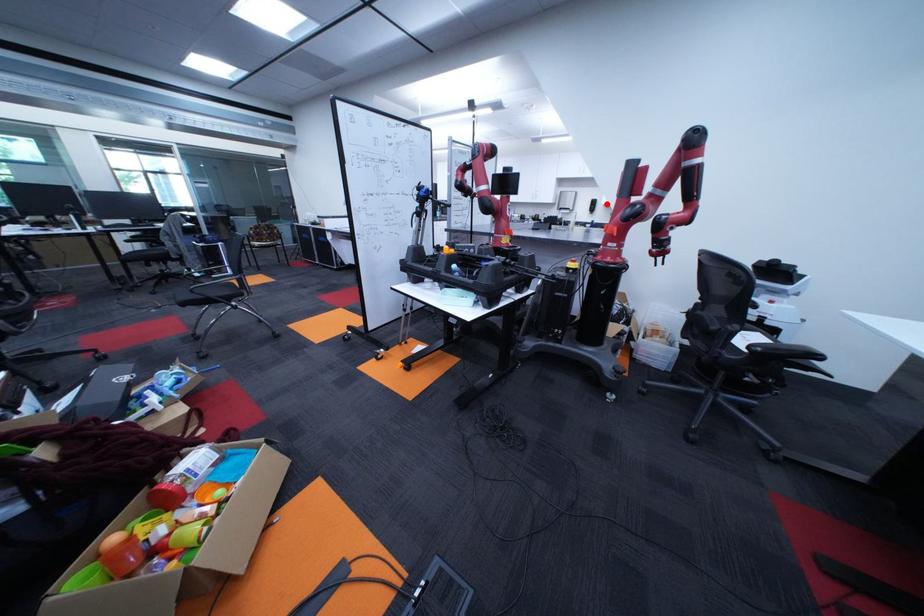
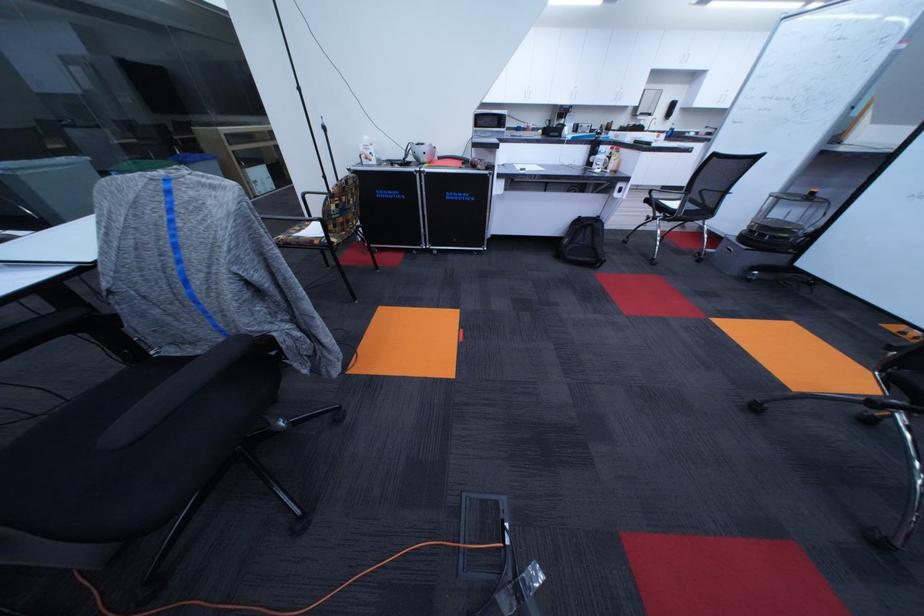
Locate, in the second image, the point that corresponds to the highlighted location in the first image.

(686, 107)